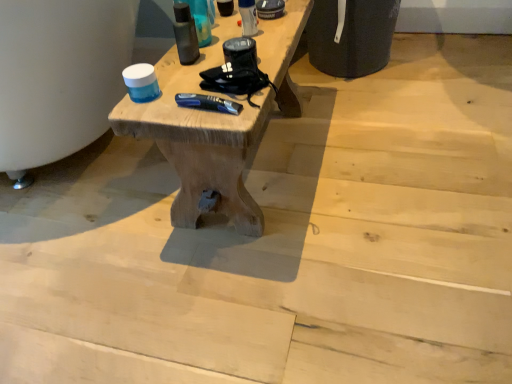
I want to click on free spot below wooden table at center (from a real-world perspective), so click(274, 157).